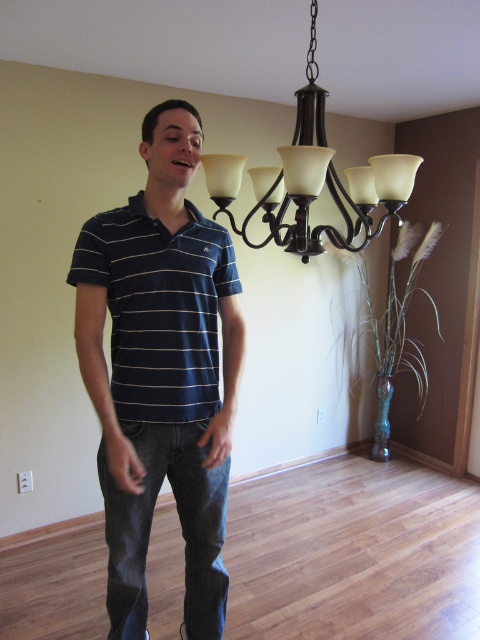
Question: Among these objects, which one is nearest to the camera?

Choices:
 (A) matte black chandelier at upper center
 (B) dark blue striped polo shirt at center

Answer: (A)

Question: Which point appears closest to the camera in this image?

Choices:
 (A) (368, 202)
 (B) (203, 397)
 (C) (232, 260)

Answer: (B)

Question: Is the position of dark blue striped polo shirt at center more distant than that of matte black chandelier at upper center?

Choices:
 (A) yes
 (B) no

Answer: (A)

Question: Is the position of navy striped polo shirt at center less distant than that of matte black chandelier at upper center?

Choices:
 (A) yes
 (B) no

Answer: (B)

Question: Does dark blue striped polo shirt at center have a smaller size compared to navy striped polo shirt at center?

Choices:
 (A) no
 (B) yes

Answer: (A)

Question: Which object is the farthest from the navy striped polo shirt at center?

Choices:
 (A) dark blue striped polo shirt at center
 (B) matte black chandelier at upper center

Answer: (B)